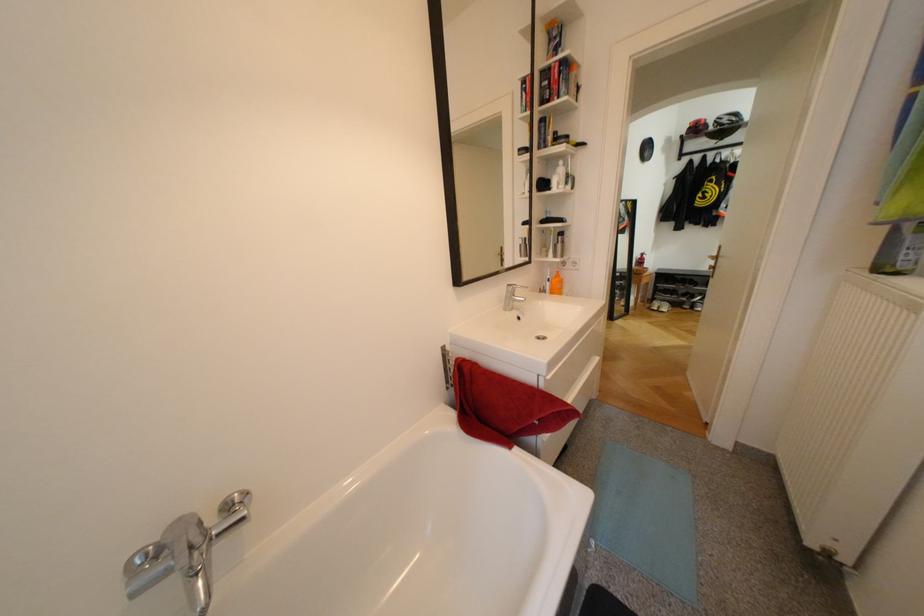
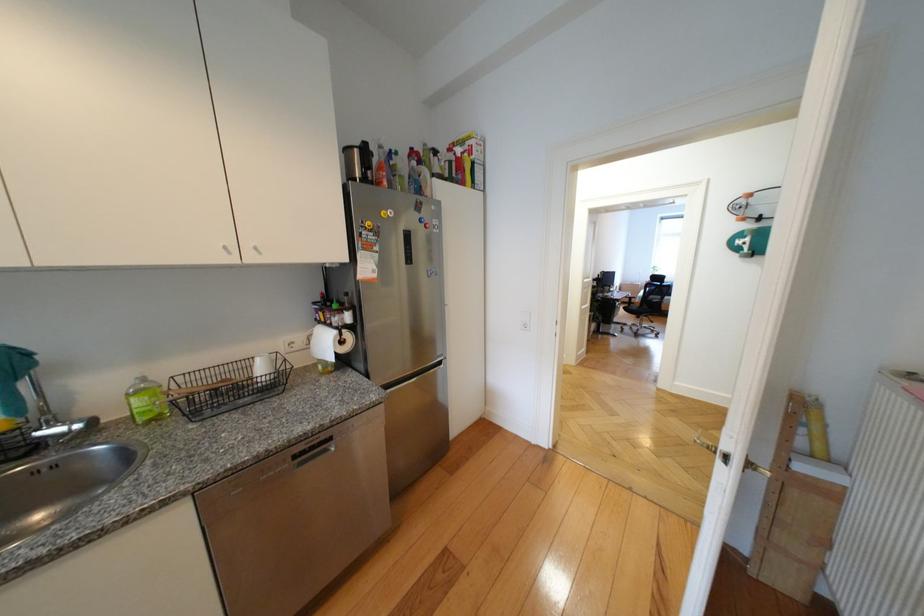
Question: The images are taken continuously from a first-person perspective. In which direction are you moving?

Choices:
 (A) Left
 (B) Right
 (C) Forward
 (D) Backward

Answer: (B)